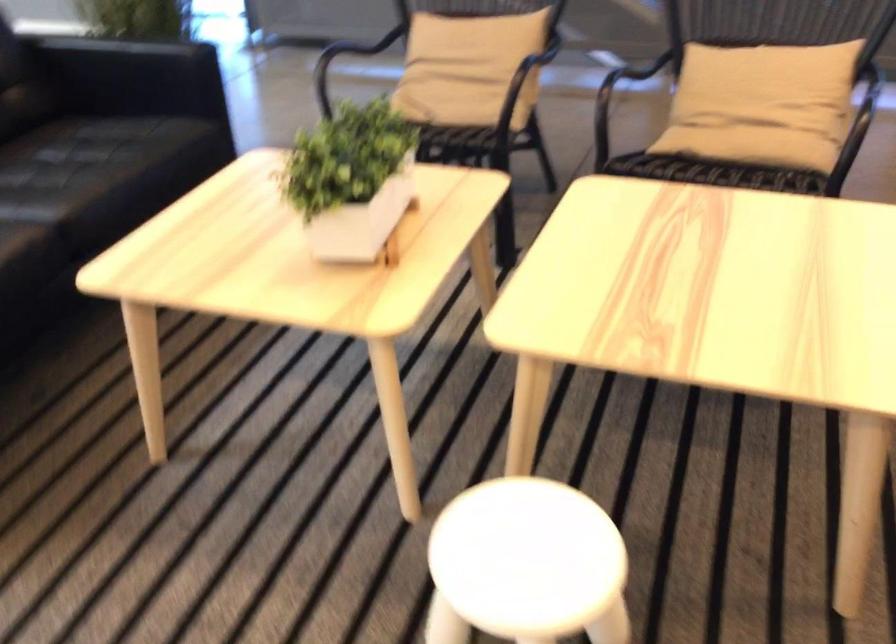
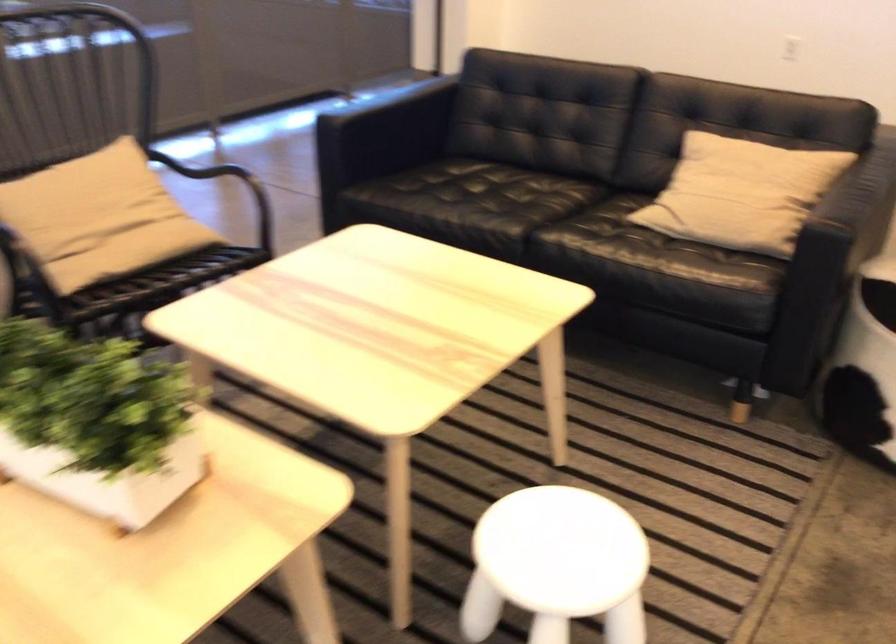
The point at (513, 567) is marked in the first image. Where is the corresponding point in the second image?

(556, 565)